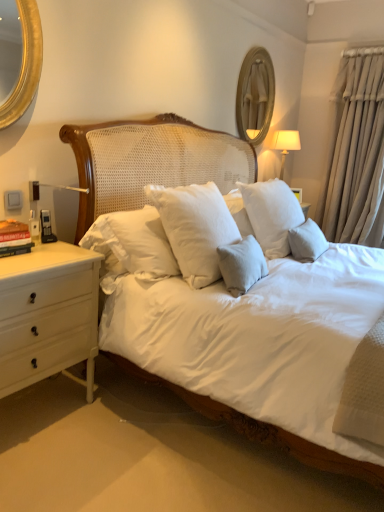
Question: Does beige fabric curtain at right have a greater height compared to wooden framed mirror at upper center?

Choices:
 (A) yes
 (B) no

Answer: (A)

Question: Can we say beige fabric curtain at right lies outside wooden framed mirror at upper center?

Choices:
 (A) no
 (B) yes

Answer: (B)

Question: From the image's perspective, is beige fabric curtain at right on top of wooden framed mirror at upper center?

Choices:
 (A) no
 (B) yes

Answer: (A)

Question: From a real-world perspective, is beige fabric curtain at right located higher than wooden framed mirror at upper center?

Choices:
 (A) yes
 (B) no

Answer: (B)

Question: Does beige fabric curtain at right have a smaller size compared to wooden framed mirror at upper center?

Choices:
 (A) no
 (B) yes

Answer: (A)

Question: Considering the positions of hardcover book at left and beige fabric curtain at right in the image, is hardcover book at left taller or shorter than beige fabric curtain at right?

Choices:
 (A) tall
 (B) short

Answer: (B)

Question: From the image's perspective, is hardcover book at left located above or below beige fabric curtain at right?

Choices:
 (A) below
 (B) above

Answer: (A)

Question: In the image, is hardcover book at left on the left side or the right side of beige fabric curtain at right?

Choices:
 (A) right
 (B) left

Answer: (B)

Question: Is hardcover book at left inside the boundaries of beige fabric curtain at right, or outside?

Choices:
 (A) inside
 (B) outside

Answer: (B)

Question: Based on their positions, is wooden framed mirror at upper center located to the left or right of white fabric lampshade at upper right?

Choices:
 (A) right
 (B) left

Answer: (B)

Question: Considering the positions of point (263, 123) and point (281, 139), is point (263, 123) closer or farther from the camera than point (281, 139)?

Choices:
 (A) farther
 (B) closer

Answer: (A)

Question: Looking at the image, does wooden framed mirror at upper center seem bigger or smaller compared to white fabric lampshade at upper right?

Choices:
 (A) big
 (B) small

Answer: (B)

Question: Which is correct: wooden framed mirror at upper center is inside white fabric lampshade at upper right, or outside of it?

Choices:
 (A) inside
 (B) outside

Answer: (B)

Question: In terms of height, does beige fabric curtain at right look taller or shorter compared to white fabric lampshade at upper right?

Choices:
 (A) tall
 (B) short

Answer: (A)

Question: Which is correct: beige fabric curtain at right is inside white fabric lampshade at upper right, or outside of it?

Choices:
 (A) outside
 (B) inside

Answer: (A)